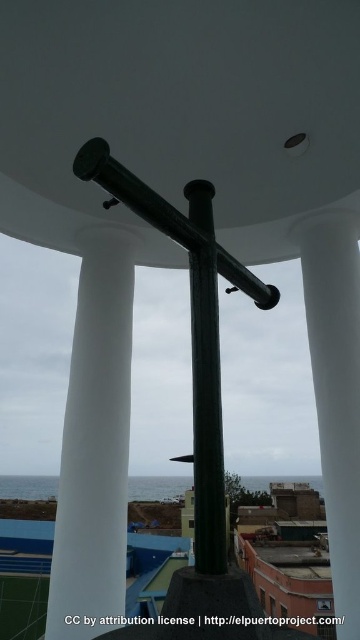
Does white smooth column at left appear on the left side of matte black beam at center?

Yes, white smooth column at left is to the left of matte black beam at center.

The image size is (360, 640). What do you see at coordinates (95, 442) in the screenshot?
I see `white smooth column at left` at bounding box center [95, 442].

The width and height of the screenshot is (360, 640). I want to click on white smooth column at left, so click(95, 442).

Who is positioned more to the left, white smooth pillar at center or glossy metal pole at center?

Positioned to the left is glossy metal pole at center.

Who is more forward, (348, 588) or (204, 554)?

Point (204, 554)

What are the coordinates of `white smooth pillar at center` in the screenshot? It's located at (335, 390).

Is white smooth column at left closer to the viewer compared to white smooth pillar at center?

No.

Based on the photo, is white smooth column at left thinner than white smooth pillar at center?

In fact, white smooth column at left might be wider than white smooth pillar at center.

Does point (79, 552) come behind point (358, 483)?

Yes, it is.

Find the location of a particular element. white smooth column at left is located at coordinates (95, 442).